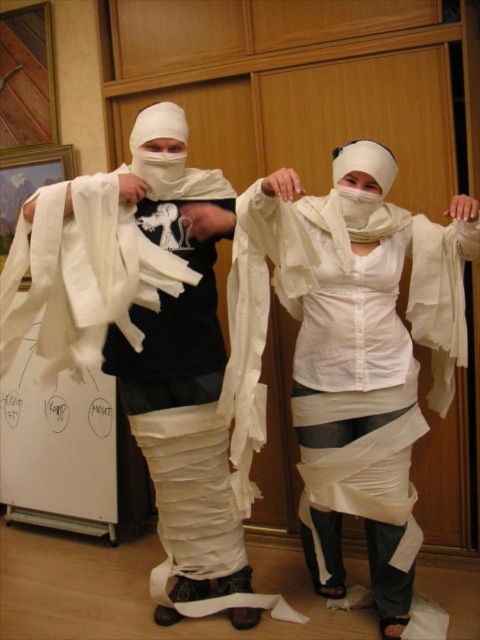
Question: Does white matte toilet paper at center come behind white paper at center?

Choices:
 (A) no
 (B) yes

Answer: (A)

Question: Which object is closer to the camera taking this photo?

Choices:
 (A) white paper at center
 (B) white matte toilet paper at center

Answer: (B)

Question: Which object is farther from the camera taking this photo?

Choices:
 (A) white matte toilet paper at center
 (B) white paper at center

Answer: (B)

Question: Is white matte toilet paper at center smaller than white paper at center?

Choices:
 (A) no
 (B) yes

Answer: (A)

Question: Which of the following is the farthest from the observer?

Choices:
 (A) (127, 176)
 (B) (414, 570)

Answer: (B)

Question: From the image, what is the correct spatial relationship of white matte toilet paper at center in relation to white paper at center?

Choices:
 (A) below
 (B) above

Answer: (A)